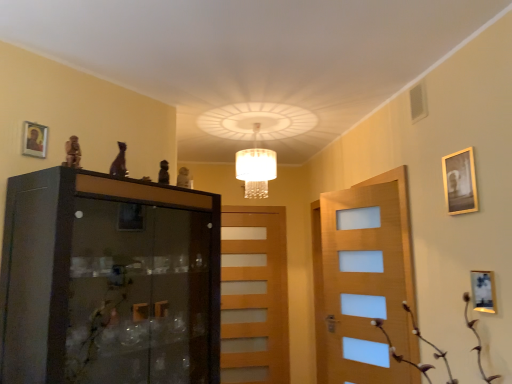
Question: From the image's perspective, is gold-framed picture at upper left, which ranks as the 3th picture frame in right-to-left order, above or below wooden picture frame at right, the 3th picture frame positioned from the left?

Choices:
 (A) above
 (B) below

Answer: (A)

Question: Relative to wooden picture frame at right, which is the third picture frame from top to bottom, is gold-framed picture at upper left, placed as the 1th picture frame when sorted from top to bottom, in front or behind?

Choices:
 (A) behind
 (B) front

Answer: (A)

Question: Which object is positioned farthest from the black glass cabinet at left?

Choices:
 (A) gold metallic picture frame at upper right, the second picture frame ordered from the bottom
 (B) wooden picture frame at right, which appears as the 1th picture frame when ordered from the bottom
 (C) gold-framed picture at upper left, placed as the 1th picture frame when sorted from top to bottom
 (D) brown textured plant at lower right
 (E) light brown wooden door at center

Answer: (E)

Question: Estimate the real-world distances between objects in this image. Which object is farther from the white crystal chandelier at center?

Choices:
 (A) light brown wooden door at center
 (B) black glass cabinet at left
 (C) gold-framed picture at upper left, which ranks as the 3th picture frame in right-to-left order
 (D) gold metallic picture frame at upper right, the 2th picture frame when ordered from top to bottom
 (E) wooden picture frame at right, which appears as the 1th picture frame when ordered from the bottom

Answer: (E)